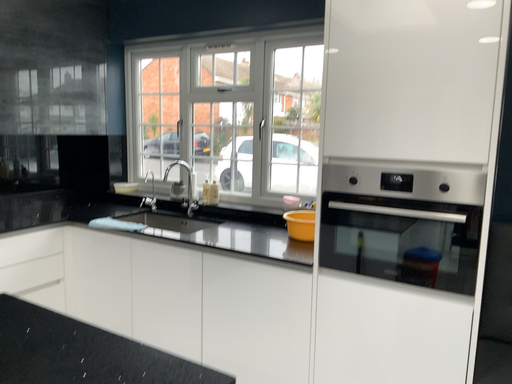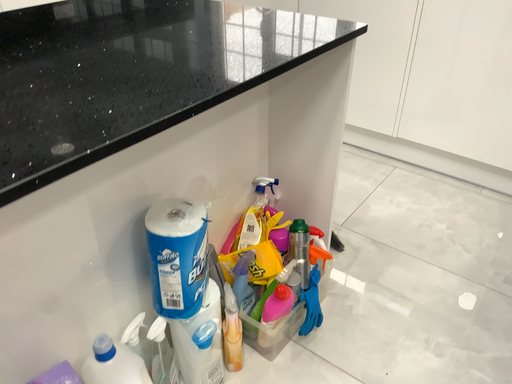
Question: Which way did the camera rotate in the video?

Choices:
 (A) rotated downward
 (B) rotated upward

Answer: (A)